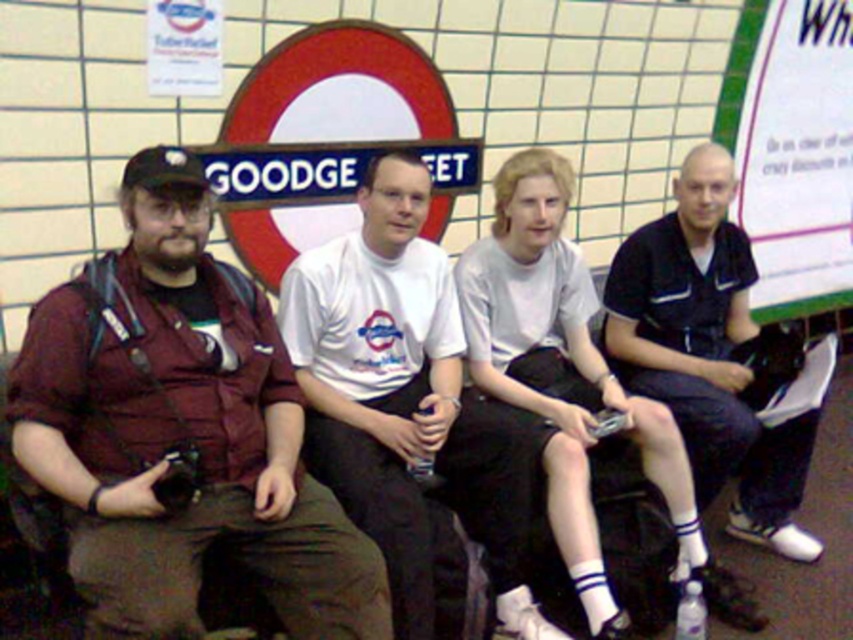
You are taking a photo of the group and notice two points marked in the image. The first point is at coordinate point (273, 483) and the second is at point (735, 362). Which point is closer to you when you are holding the camera?

Point (273, 483) is closer to the camera than point (735, 362).

You are standing in front of the London Underground sign and see two people wearing the maroon fabric shirt at left and the dark blue polo shirt at center. Which shirt is positioned more to the left side?

The maroon fabric shirt at left is positioned more to the left side than the dark blue polo shirt at center.